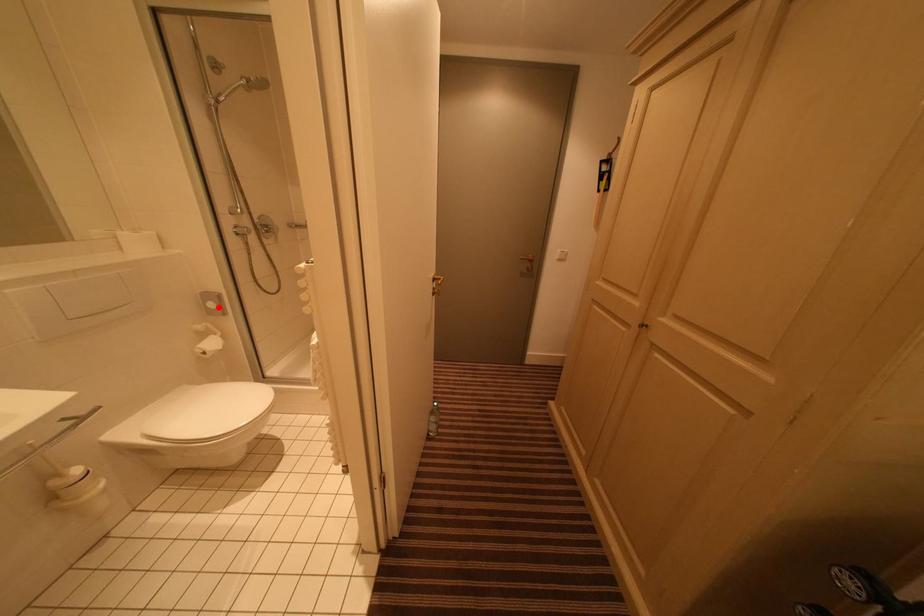
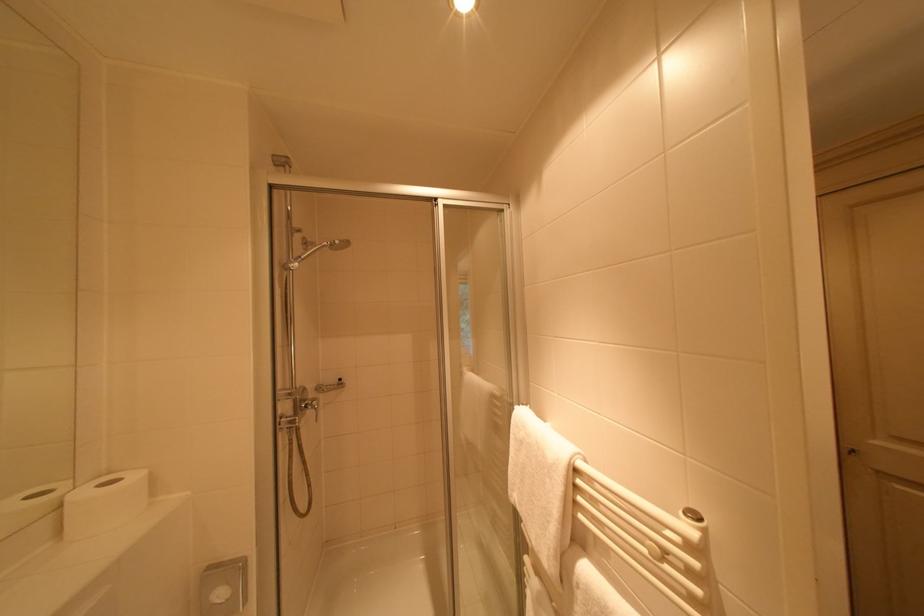
The point at the highlighted location is marked in the first image. Where is the corresponding point in the second image?

(226, 596)